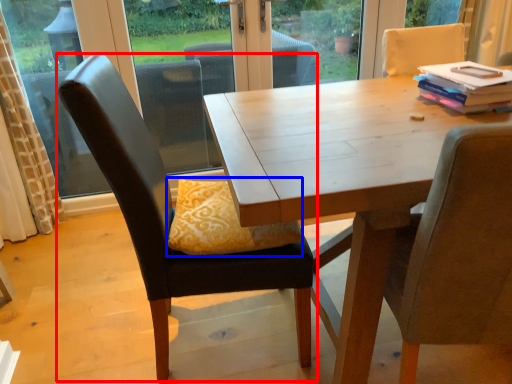
Question: Which point is further to the camera, chair (highlighted by a red box) or pillow (highlighted by a blue box)?

Choices:
 (A) chair
 (B) pillow

Answer: (B)